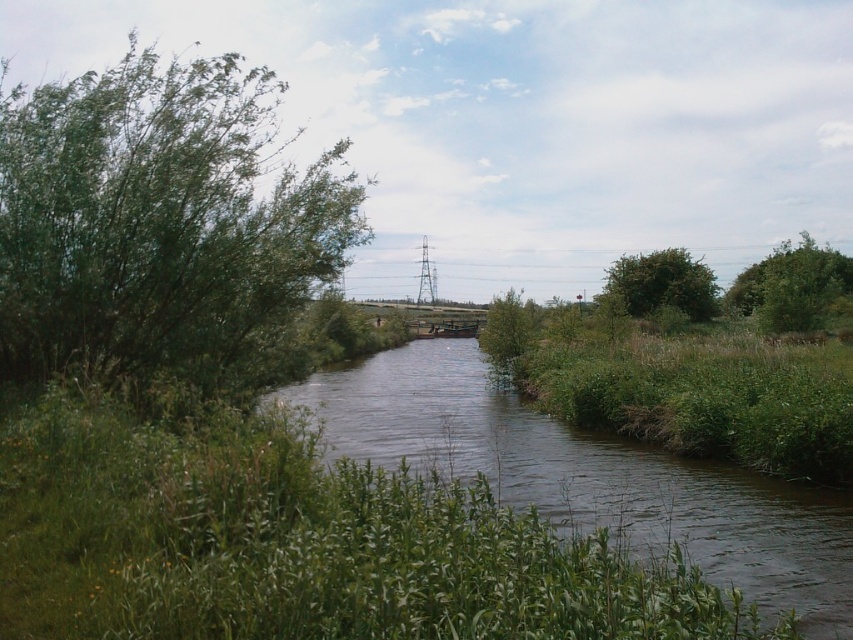
You are standing at the center of the image and want to locate the green leafy bush at right. In which direction should you look to find it?

The green leafy bush at right is located at point (792, 285), so you should look to the right side of the image to find it.

You are a hiker walking along the riverbank and want to reach the green leafy tree at center. Which direction should you walk to get closer to it without passing the green leafy bush at right?

You should walk away from the green leafy bush at right because the green leafy tree at center is closer to you than the green leafy bush at right, so moving away from the bush will bring you closer to the tree.